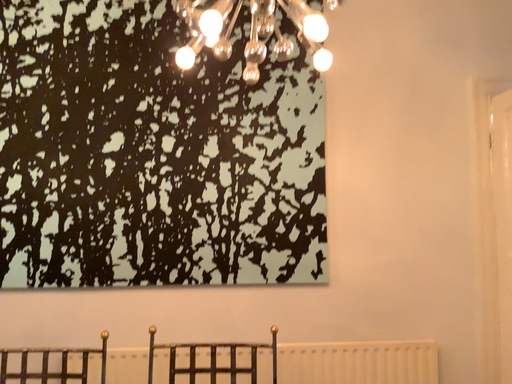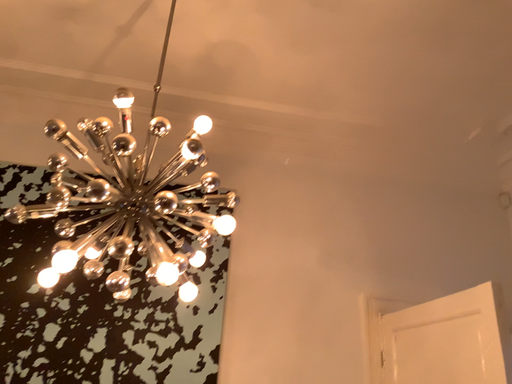
Question: Which way did the camera rotate in the video?

Choices:
 (A) rotated downward
 (B) rotated upward

Answer: (B)